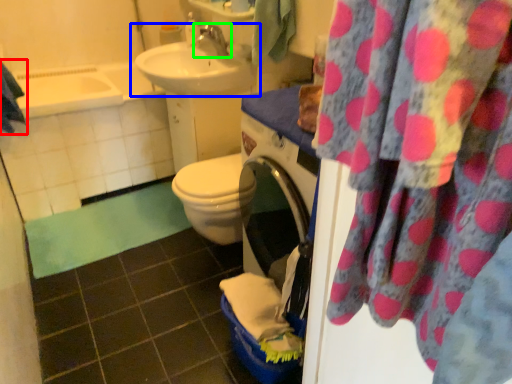
Question: Which object is the closest to the beach towel (highlighted by a red box)? Choose among these: sink (highlighted by a blue box) or tap (highlighted by a green box).

Choices:
 (A) sink
 (B) tap

Answer: (A)